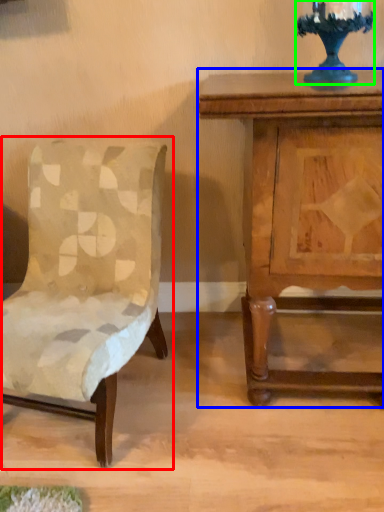
Question: Estimate the real-world distances between objects in this image. Which object is closer to chair (highlighted by a red box), nightstand (highlighted by a blue box) or candle holder (highlighted by a green box)?

Choices:
 (A) nightstand
 (B) candle holder

Answer: (A)